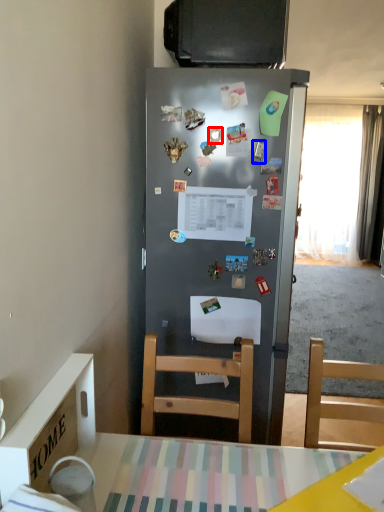
Question: Which point is further to the camera, magnet (highlighted by a red box) or magnet (highlighted by a blue box)?

Choices:
 (A) magnet
 (B) magnet

Answer: (B)